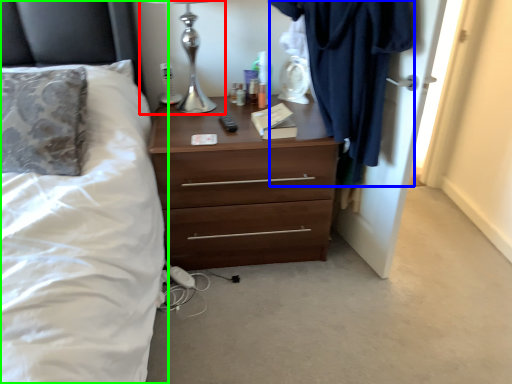
Question: Based on their relative distances, which object is nearer to table lamp (highlighted by a red box)? Choose from clothing (highlighted by a blue box) and bed (highlighted by a green box).

Choices:
 (A) clothing
 (B) bed

Answer: (B)